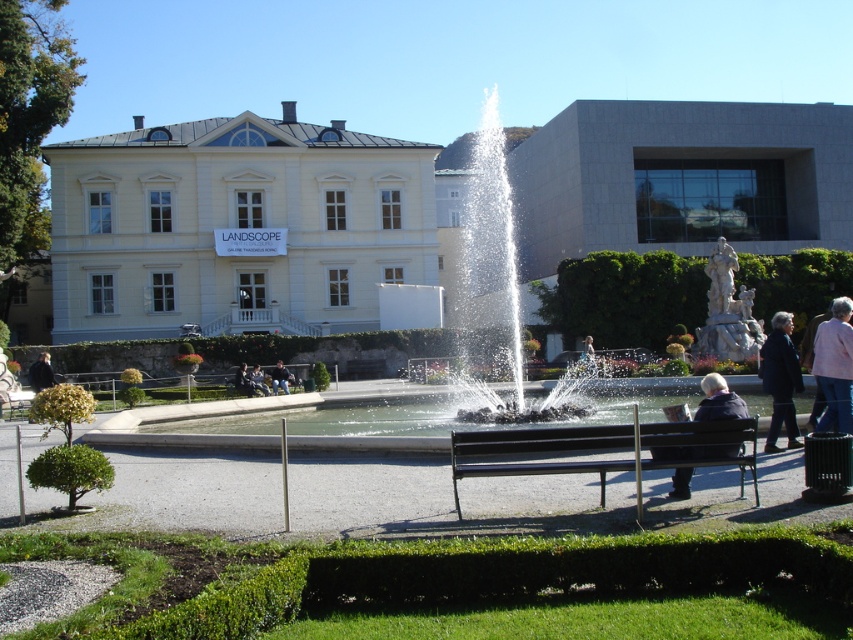
You are standing in the park and want to take a photo of the white marble statue at center. Your camera has a maximum zoom range of 50 feet. Can you capture the statue clearly without moving closer?

The white marble statue at center is 93.72 feet away from viewer, which exceeds the camera maximum zoom range of 50 feet. Therefore, you cannot capture the statue clearly without moving closer.

You are a visitor in the park and want to take a photo of the white marble statue at center without any obstructions. Is the light brown leather jacket at center blocking your view of the statue?

The light brown leather jacket at center is behind the white marble statue at center, so it is not blocking the view of the statue.

You are standing at the center of the park facing the fountain. You want to take a photo of the white smooth building at upper left without moving your position. Is the building visible in your current line of sight?

The white smooth building at upper left is located at point (236, 228), which means it is positioned to the upper left from your current position at the center. Since there are no mentioned obstacles blocking the view, the building should be visible in your line of sight.